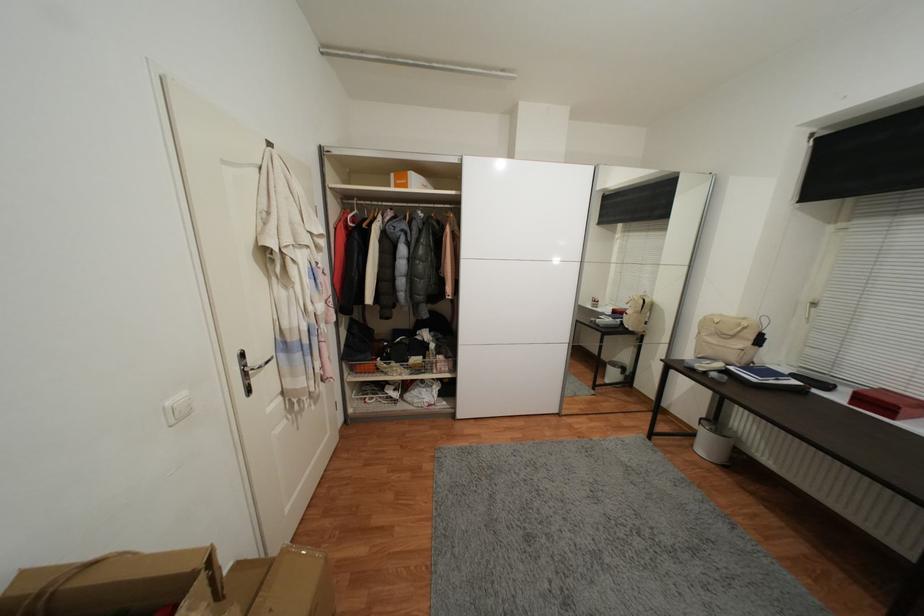
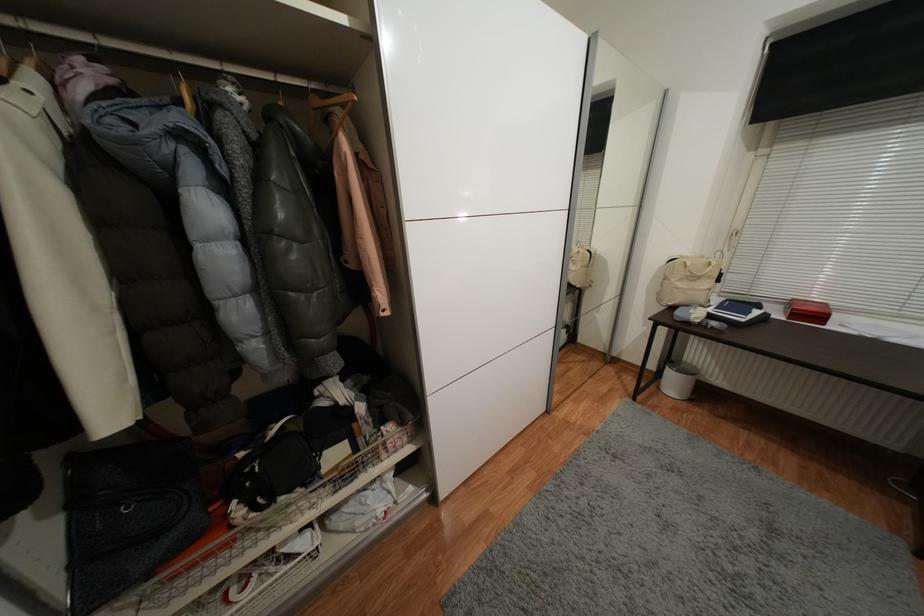
Find the pixel in the second image that matches pixel 637 334 in the first image.

(582, 291)